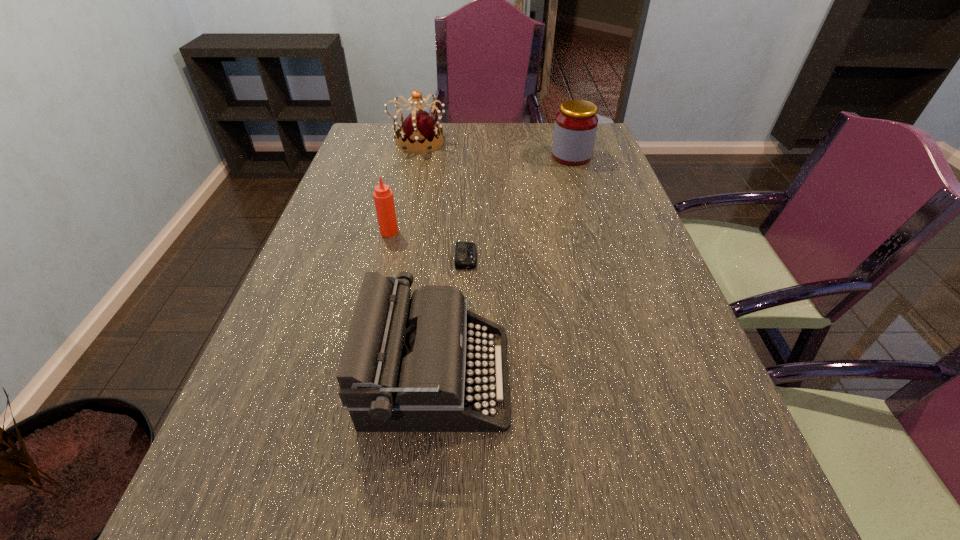
At what (x,y) coordinates should I click in order to perform the action: click on blank space at the far left corner of the desktop. Please return your answer as a coordinate pair (x, y). The height and width of the screenshot is (540, 960). Looking at the image, I should click on (389, 136).

Where is `free space between the typewriter and the jar`? The image size is (960, 540). free space between the typewriter and the jar is located at coordinates (504, 266).

What are the coordinates of `empty space that is in between the fourth farthest object and the tallest object` in the screenshot? It's located at pos(442,200).

You are a GUI agent. You are given a task and a screenshot of the screen. Output one action in this format:
    pyautogui.click(x=<x>, y=<y>)
    Task: Click on the free point between the alarm clock and the jar
    
    Given the screenshot: What is the action you would take?
    pyautogui.click(x=518, y=207)

Identify the location of vacant point located between the tallest object and the nearest object. This screenshot has height=540, width=960. (427, 259).

Identify the location of vacant area that lies between the rightmost object and the shortest object. Image resolution: width=960 pixels, height=540 pixels. (518, 207).

Find the location of a particular element. This screenshot has height=540, width=960. vacant area that lies between the tiara and the typewriter is located at coordinates (427, 259).

Where is `free space between the nearest object and the jar`? free space between the nearest object and the jar is located at coordinates (504, 266).

The height and width of the screenshot is (540, 960). I want to click on object that ranks as the fourth closest to the typewriter, so point(419,131).

Locate which object ranks in proximity to the third farthest object. Please provide its 2D coordinates. Your answer should be formatted as a tuple, i.e. [(x, y)], where the tuple contains the x and y coordinates of a point satisfying the conditions above.

[(465, 252)]